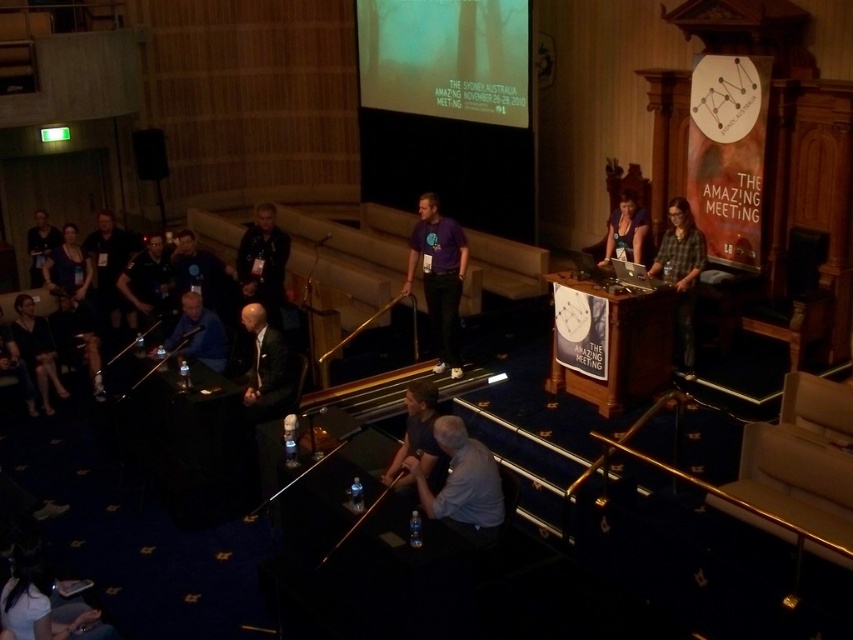
Question: Can you confirm if gray fabric shirt at lower center is thinner than black fabric dress at lower left?

Choices:
 (A) yes
 (B) no

Answer: (B)

Question: Can you confirm if dark gray fabric shirt at lower center is positioned above matte blue shirt at upper right?

Choices:
 (A) yes
 (B) no

Answer: (B)

Question: Based on their relative distances, which object is nearer to the black fabric dress at lower left?

Choices:
 (A) black suit at center
 (B) dark blue shirt at left
 (C) purple cotton shirt at center

Answer: (B)

Question: Does dark gray fabric shirt at lower center have a lesser width compared to black fabric dress at lower left?

Choices:
 (A) yes
 (B) no

Answer: (A)

Question: Among these objects, which one is farthest from the camera?

Choices:
 (A) matte blue shirt at upper right
 (B) plaid fabric shirt at center
 (C) black fabric dress at lower left

Answer: (A)

Question: Which of the following is the closest to the observer?

Choices:
 (A) (445, 417)
 (B) (57, 278)
 (C) (252, 346)
 (D) (22, 355)

Answer: (A)